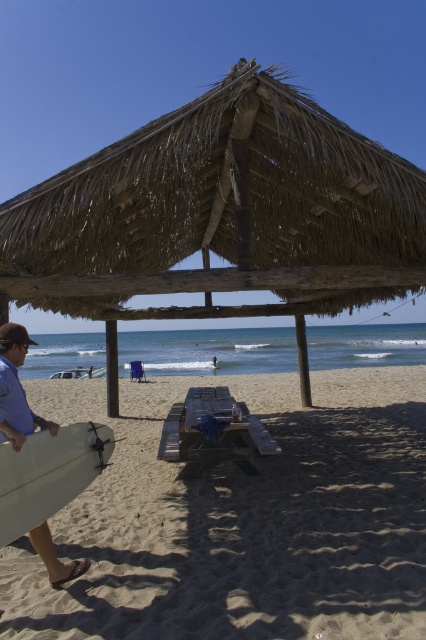
Is sandy beach at lower left to the left of white matte surfboard at lower left from the viewer's perspective?

In fact, sandy beach at lower left is to the right of white matte surfboard at lower left.

Does sandy beach at lower left have a larger size compared to white matte surfboard at lower left?

Yes.

You are a GUI agent. You are given a task and a screenshot of the screen. Output one action in this format:
    pyautogui.click(x=<x>, y=<y>)
    Task: Click on the sandy beach at lower left
    The image size is (426, 640).
    Given the screenshot: What is the action you would take?
    pyautogui.click(x=239, y=518)

At what (x,y) coordinates should I click in order to perform the action: click on sandy beach at lower left. Please return your answer as a coordinate pair (x, y). This screenshot has height=640, width=426. Looking at the image, I should click on (239, 518).

Where is `sandy beach at lower left`? This screenshot has height=640, width=426. sandy beach at lower left is located at coordinates (239, 518).

Does thatched straw hut at center have a greater width compared to white foam surfboard at left?

Yes, thatched straw hut at center is wider than white foam surfboard at left.

Which of these two, thatched straw hut at center or white foam surfboard at left, stands taller?

With more height is white foam surfboard at left.

Describe the element at coordinates (221, 216) in the screenshot. I see `thatched straw hut at center` at that location.

The height and width of the screenshot is (640, 426). Find the location of `thatched straw hut at center`. thatched straw hut at center is located at coordinates (221, 216).